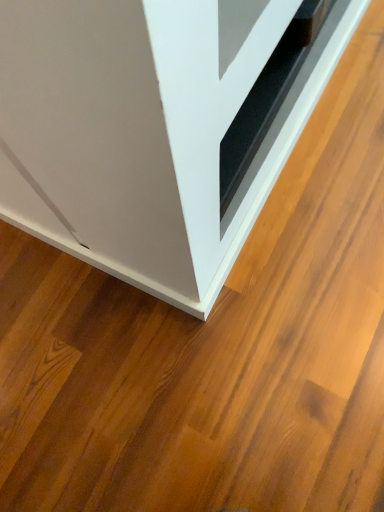
Question: Should I look upward or downward to see white glossy cabinet at lower left?

Choices:
 (A) up
 (B) down

Answer: (A)